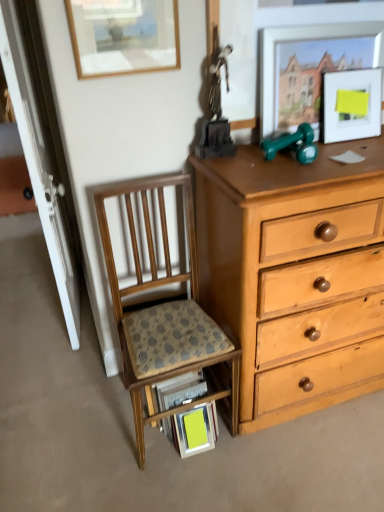
Question: Visually, is wooden picture frame at upper left, positioned as the 3th picture frame in right-to-left order, positioned to the left or to the right of wooden desk at lower center?

Choices:
 (A) left
 (B) right

Answer: (A)

Question: From the image's perspective, is wooden picture frame at upper left, the 1th picture frame in the left-to-right sequence, positioned above or below wooden desk at lower center?

Choices:
 (A) above
 (B) below

Answer: (A)

Question: Which of these objects is positioned farthest from the green rubber dumbbells at upper right?

Choices:
 (A) wooden picture frame at upper left, the 1th picture frame in the left-to-right sequence
 (B) wooden desk at lower center
 (C) wooden chair with patterned cushion at lower left
 (D) matte white picture frame at upper right, which ranks as the 3th picture frame in left-to-right order
 (E) matte silver picture frame at upper right, the second picture frame in the right-to-left sequence

Answer: (B)

Question: Considering the real-world distances, which object is farthest from the matte white picture frame at upper right, which ranks as the 3th picture frame in left-to-right order?

Choices:
 (A) matte silver picture frame at upper right, which ranks as the 2th picture frame in left-to-right order
 (B) wooden chair with patterned cushion at lower left
 (C) wooden picture frame at upper left, the 1th picture frame in the left-to-right sequence
 (D) wooden desk at lower center
 (E) green rubber dumbbells at upper right

Answer: (D)